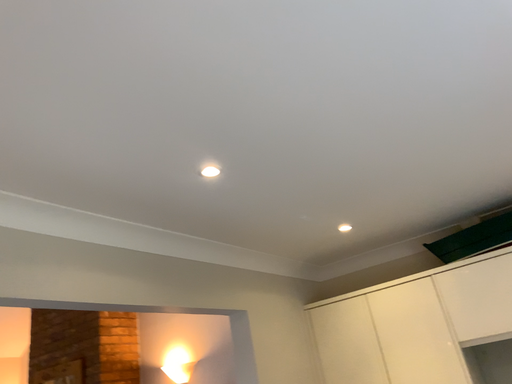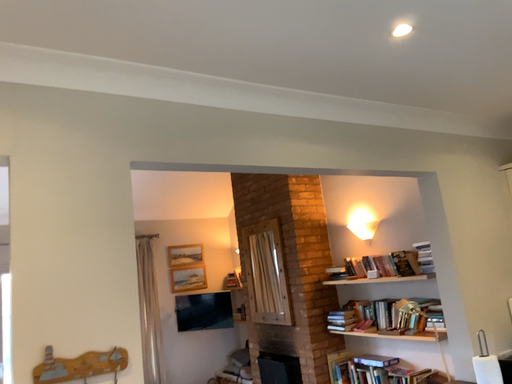
Question: Which way did the camera rotate in the video?

Choices:
 (A) rotated right
 (B) rotated left

Answer: (B)